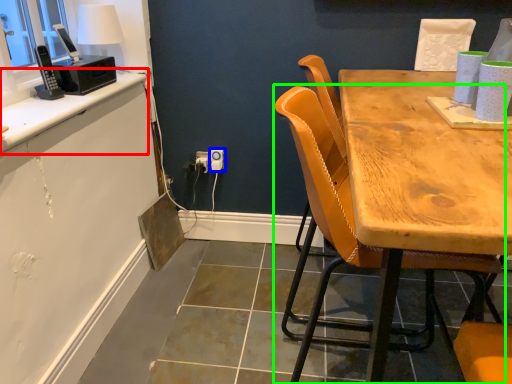
Question: Which object is positioned closest to counter top (highlighted by a red box)? Select from power outlet (highlighted by a blue box) and chair (highlighted by a green box).

Choices:
 (A) power outlet
 (B) chair

Answer: (A)